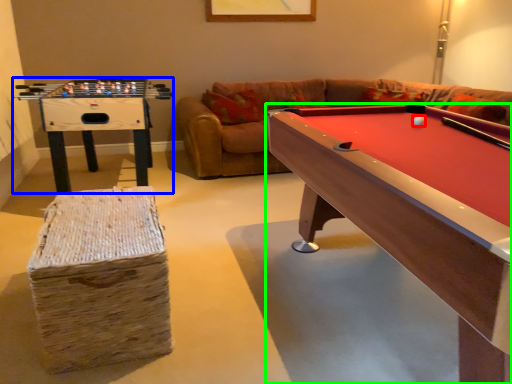
Question: Which object is the farthest from ball (highlighted by a red box)? Choose among these: table (highlighted by a blue box) or billiard table (highlighted by a green box).

Choices:
 (A) table
 (B) billiard table

Answer: (A)